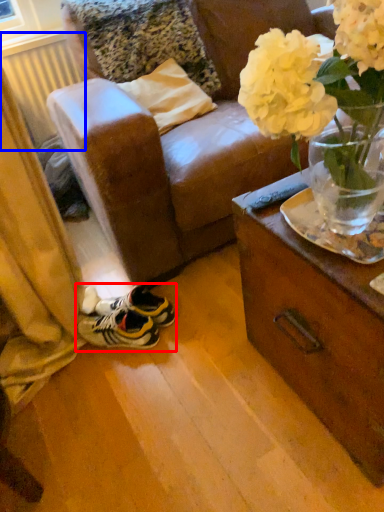
Question: Which point is closer to the camera, footwear (highlighted by a red box) or radiator (highlighted by a blue box)?

Choices:
 (A) footwear
 (B) radiator

Answer: (A)